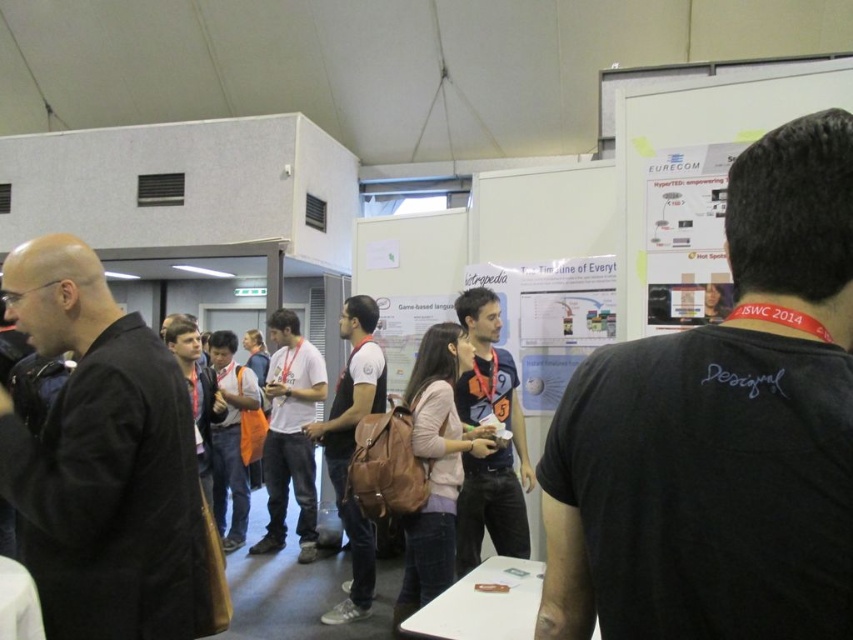
Describe the element at coordinates (289, 433) in the screenshot. I see `white cotton shirt at center` at that location.

Who is more distant from viewer, (283, 339) or (363, 536)?

Positioned behind is point (283, 339).

Locate an element on the screen. This screenshot has width=853, height=640. white cotton shirt at center is located at coordinates (289, 433).

Is point (647, 122) more distant than point (311, 556)?

No, it is not.

Is white paperboard at upper right bigger than white cotton shirt at center?

Incorrect, white paperboard at upper right is not larger than white cotton shirt at center.

This screenshot has height=640, width=853. I want to click on white paperboard at upper right, so click(x=698, y=144).

The height and width of the screenshot is (640, 853). What are the coordinates of `white paperboard at upper right` in the screenshot? It's located at (698, 144).

Is black t-shirt at upper right positioned behind orange fabric backpack at center?

That is False.

Is point (556, 564) positioned after point (219, 529)?

No, (556, 564) is closer to viewer.

I want to click on black t-shirt at upper right, so click(x=721, y=433).